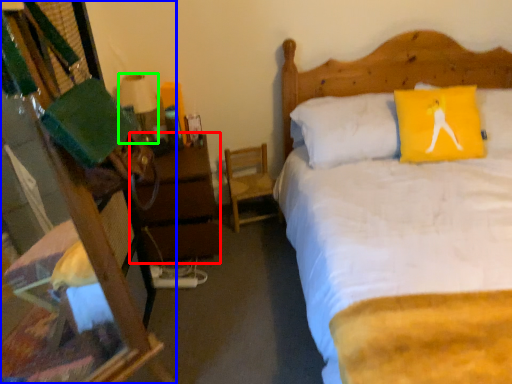
Question: Which object is the farthest from nightstand (highlighted by a red box)? Choose among these: desk (highlighted by a blue box) or lamp (highlighted by a green box).

Choices:
 (A) desk
 (B) lamp

Answer: (A)